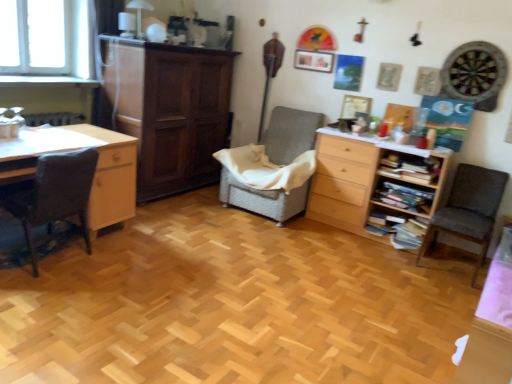
Locate an element on the screen. This screenshot has width=512, height=384. vacant space in front of dark gray fabric chair at right, which appears as the third chair when viewed from the left is located at coordinates (450, 287).